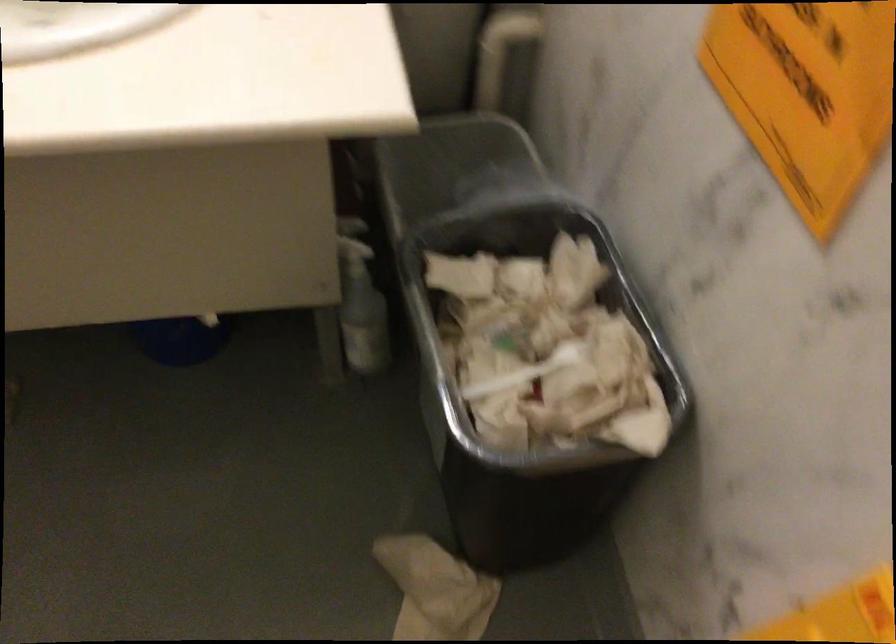
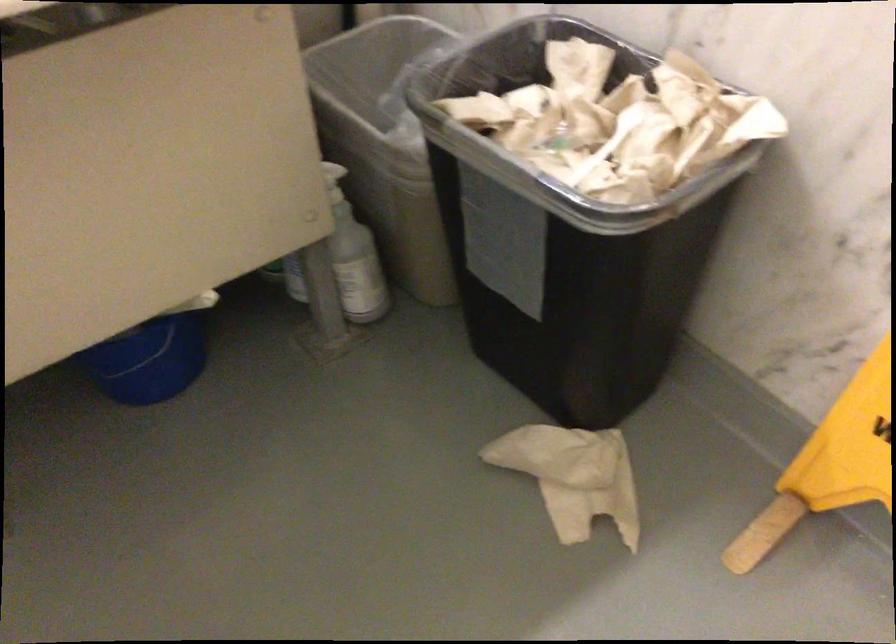
Question: The images are taken continuously from a first-person perspective. In which direction are you moving?

Choices:
 (A) Left
 (B) Right
 (C) Forward
 (D) Backward

Answer: (A)